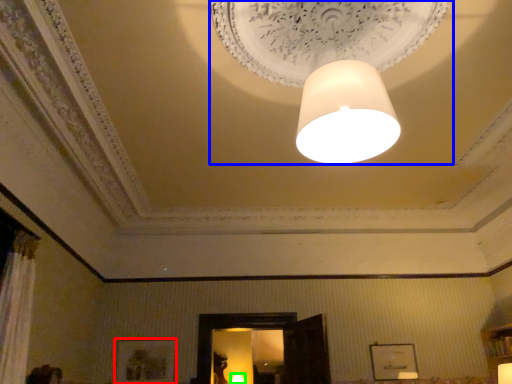
Question: Based on their relative distances, which object is farther from picture frame (highlighted by a red box)? Choose from lamp (highlighted by a blue box) and lamp (highlighted by a green box).

Choices:
 (A) lamp
 (B) lamp

Answer: (A)